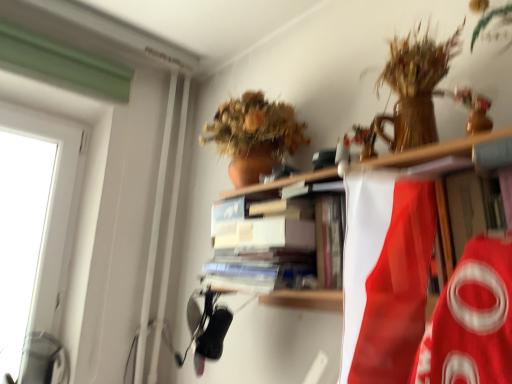
Question: Is white cardboard book at center at the left side of wooden shelf at upper center?

Choices:
 (A) no
 (B) yes

Answer: (B)

Question: From a real-world perspective, is white cardboard book at center below wooden shelf at upper center?

Choices:
 (A) no
 (B) yes

Answer: (A)

Question: Is white cardboard book at center facing away from wooden shelf at upper center?

Choices:
 (A) no
 (B) yes

Answer: (B)

Question: Is white cardboard book at center wider than wooden shelf at upper center?

Choices:
 (A) no
 (B) yes

Answer: (B)

Question: Are white cardboard book at center and wooden shelf at upper center far apart?

Choices:
 (A) no
 (B) yes

Answer: (A)

Question: Is white cardboard book at center taller than wooden shelf at upper center?

Choices:
 (A) no
 (B) yes

Answer: (A)

Question: From the image's perspective, does wooden shelf at upper center appear higher than white cardboard book at center?

Choices:
 (A) no
 (B) yes

Answer: (A)

Question: From a real-world perspective, is wooden shelf at upper center on top of white cardboard book at center?

Choices:
 (A) no
 (B) yes

Answer: (A)

Question: Can white cardboard book at center be found inside wooden shelf at upper center?

Choices:
 (A) yes
 (B) no

Answer: (A)

Question: Is wooden shelf at upper center positioned behind white cardboard book at center?

Choices:
 (A) yes
 (B) no

Answer: (B)

Question: Is wooden shelf at upper center thinner than white cardboard book at center?

Choices:
 (A) no
 (B) yes

Answer: (B)

Question: From a real-world perspective, is wooden shelf at upper center under white cardboard book at center?

Choices:
 (A) yes
 (B) no

Answer: (A)

Question: Looking at their shapes, would you say wooden shelf at upper center is wider or thinner than white cardboard book at center?

Choices:
 (A) wide
 (B) thin

Answer: (B)